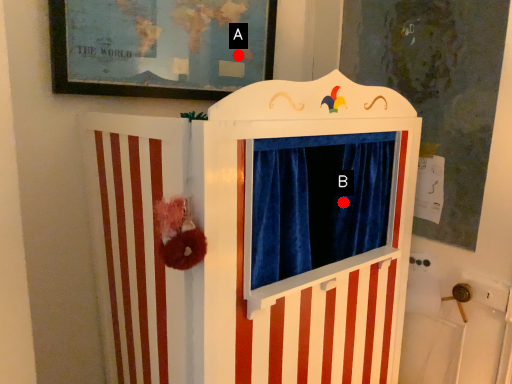
Question: Two points are circled on the image, labeled by A and B beside each circle. Among these points, which one is nearest to the camera?

Choices:
 (A) A is closer
 (B) B is closer

Answer: (B)